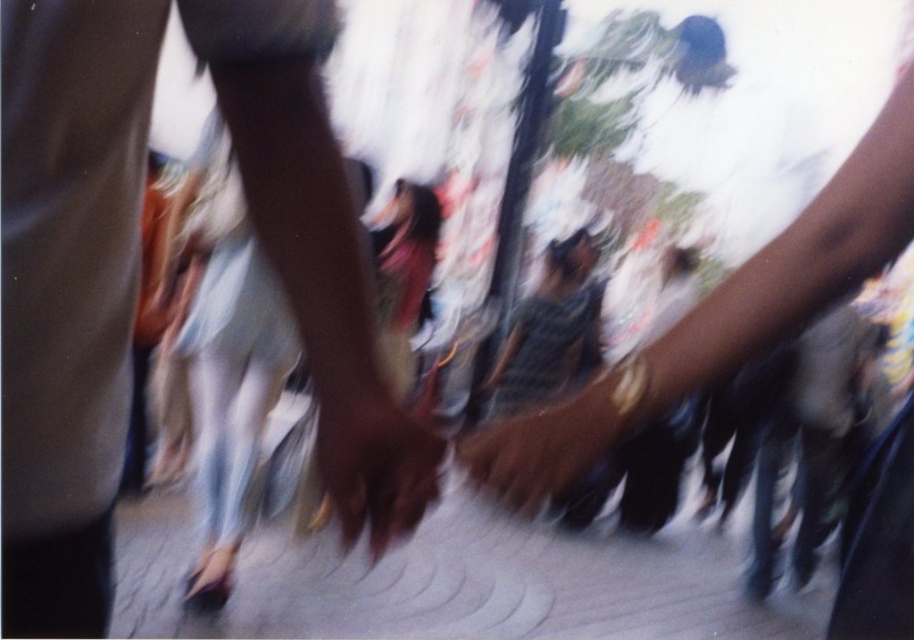
You are a person standing on the gray concrete pavement at center. You want to reach the brown leather hand at center. Is the hand above or below you?

The gray concrete pavement at center is located below brown leather hand at center, so the brown leather hand at center is above you.

You are a photographer standing at the edge of a busy street. You notice the gray concrete pavement at center and the smooth brown hand at center in your viewfinder. Which object is closer to the ground?

The gray concrete pavement at center is below the smooth brown hand at center, so the gray concrete pavement at center is closer to the ground.